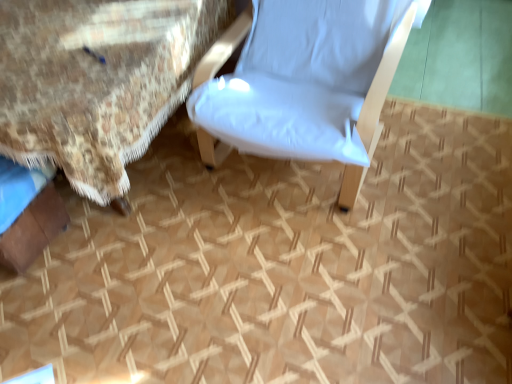
At what (x,y) coordinates should I click in order to perform the action: click on floral fabric bed at center. Please return your answer as a coordinate pair (x, y). The width and height of the screenshot is (512, 384). Looking at the image, I should click on (97, 81).

What is the approximate width of floral fabric bed at center?

The width of floral fabric bed at center is 1.36 meters.

This screenshot has height=384, width=512. What do you see at coordinates (97, 81) in the screenshot? I see `floral fabric bed at center` at bounding box center [97, 81].

The width and height of the screenshot is (512, 384). I want to click on white fabric chair at center, so click(304, 82).

The width and height of the screenshot is (512, 384). What do you see at coordinates (304, 82) in the screenshot? I see `white fabric chair at center` at bounding box center [304, 82].

The image size is (512, 384). Identify the location of floral fabric bed at center. coord(97,81).

Between white fabric chair at center and floral fabric bed at center, which one appears on the left side from the viewer's perspective?

Positioned to the left is floral fabric bed at center.

Which object is closer to the camera taking this photo, white fabric chair at center or floral fabric bed at center?

white fabric chair at center is in front.

Considering the points (307, 28) and (146, 80), which point is in front, point (307, 28) or point (146, 80)?

The point (146, 80) is in front.

From the image's perspective, is white fabric chair at center above or below floral fabric bed at center?

From the image's perspective, white fabric chair at center appears above floral fabric bed at center.

From a real-world perspective, is white fabric chair at center on top of floral fabric bed at center?

Yes, from a real-world perspective, white fabric chair at center is over floral fabric bed at center

Considering the sizes of objects white fabric chair at center and floral fabric bed at center in the image provided, who is thinner, white fabric chair at center or floral fabric bed at center?

white fabric chair at center.

Does white fabric chair at center have a greater height compared to floral fabric bed at center?

Indeed, white fabric chair at center has a greater height compared to floral fabric bed at center.

Can you confirm if white fabric chair at center is bigger than floral fabric bed at center?

Actually, white fabric chair at center might be smaller than floral fabric bed at center.

Based on the photo, is white fabric chair at center surrounding floral fabric bed at center?

Actually, floral fabric bed at center is outside white fabric chair at center.

Is white fabric chair at center touching floral fabric bed at center?

No, white fabric chair at center is not making contact with floral fabric bed at center.

Is white fabric chair at center facing towards floral fabric bed at center?

No, white fabric chair at center is not aimed at floral fabric bed at center.

Can you tell me how much white fabric chair at center and floral fabric bed at center differ in facing direction?

white fabric chair at center and floral fabric bed at center are facing 5.37 degrees away from each other.

I want to click on chair above the floral fabric bed at center (from a real-world perspective), so (x=304, y=82).

Considering the relative positions of floral fabric bed at center and white fabric chair at center in the image provided, is floral fabric bed at center to the left of white fabric chair at center from the viewer's perspective?

Yes.

Does floral fabric bed at center lie in front of white fabric chair at center?

No, floral fabric bed at center is further to the viewer.

Is point (63, 163) farther from viewer compared to point (368, 12)?

No, (63, 163) is in front of (368, 12).

From the image's perspective, between floral fabric bed at center and white fabric chair at center, who is located below?

floral fabric bed at center is shown below in the image.

From a real-world perspective, is floral fabric bed at center positioned under white fabric chair at center based on gravity?

Yes.

Which of these two, floral fabric bed at center or white fabric chair at center, is wider?

With larger width is floral fabric bed at center.

Consider the image. Considering the sizes of floral fabric bed at center and white fabric chair at center in the image, is floral fabric bed at center taller or shorter than white fabric chair at center?

Clearly, floral fabric bed at center is shorter compared to white fabric chair at center.

Which of these two, floral fabric bed at center or white fabric chair at center, is smaller?

Smaller between the two is white fabric chair at center.

From the picture: Is floral fabric bed at center outside of white fabric chair at center?

Yes, floral fabric bed at center is outside of white fabric chair at center.

In the scene shown: Is floral fabric bed at center placed right next to white fabric chair at center?

floral fabric bed at center and white fabric chair at center are clearly separated.

Is floral fabric bed at center oriented towards white fabric chair at center?

No.

How distant is floral fabric bed at center from white fabric chair at center?

floral fabric bed at center and white fabric chair at center are 15.11 inches apart.

This screenshot has height=384, width=512. In order to click on bed below the white fabric chair at center (from a real-world perspective) in this screenshot , I will do `click(97, 81)`.

I want to click on chair above the floral fabric bed at center (from a real-world perspective), so click(x=304, y=82).

Locate an element on the screen. This screenshot has height=384, width=512. chair in front of the floral fabric bed at center is located at coordinates (304, 82).